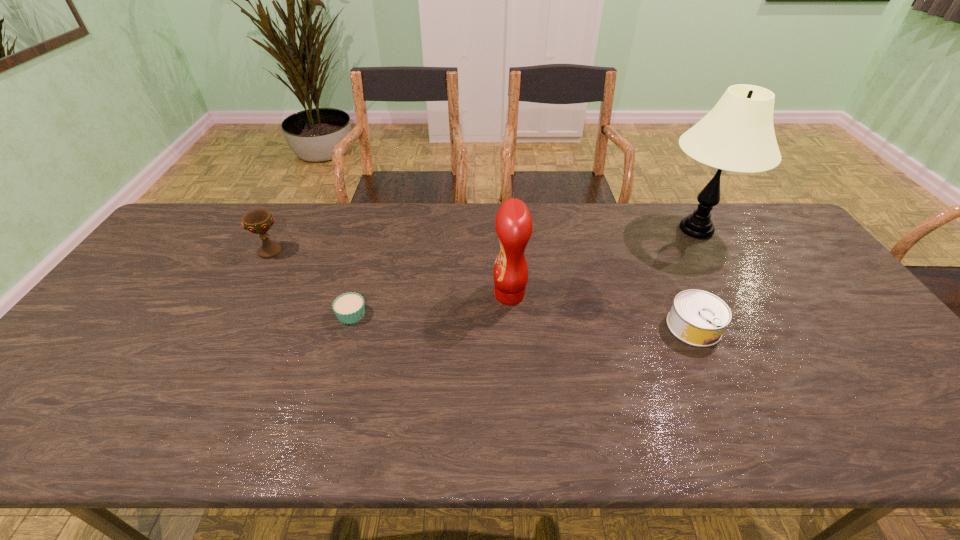
Locate an element on the screen. free space at the far right corner is located at coordinates (749, 221).

Where is `vacant area that lies between the can and the chalice`? The width and height of the screenshot is (960, 540). vacant area that lies between the can and the chalice is located at coordinates (482, 289).

Image resolution: width=960 pixels, height=540 pixels. I want to click on unoccupied position between the tallest object and the condiment, so click(603, 262).

You are a GUI agent. You are given a task and a screenshot of the screen. Output one action in this format:
    pyautogui.click(x=<x>, y=<y>)
    Task: Click on the free space between the fourth object from right to left and the leftmost object
    The image size is (960, 540).
    Given the screenshot: What is the action you would take?
    pyautogui.click(x=311, y=283)

Image resolution: width=960 pixels, height=540 pixels. Identify the location of free space between the second tallest object and the cupcake. (430, 305).

At what (x,y) coordinates should I click in order to perform the action: click on vacant area between the fourth tallest object and the condiment. Please return your answer as a coordinate pair (x, y). The image size is (960, 540). Looking at the image, I should click on (602, 311).

Identify the location of vacant point located between the second shortest object and the third object from left to right. (602, 311).

Find the location of `empty space that is in between the third tallest object and the can`. empty space that is in between the third tallest object and the can is located at coordinates (482, 289).

Locate an element on the screen. This screenshot has width=960, height=540. unoccupied position between the leftmost object and the third object from right to left is located at coordinates (390, 273).

Locate which object is the closest to the fourth object from right to left. Please provide its 2D coordinates. Your answer should be formatted as a tuple, i.e. [(x, y)], where the tuple contains the x and y coordinates of a point satisfying the conditions above.

[(259, 221)]